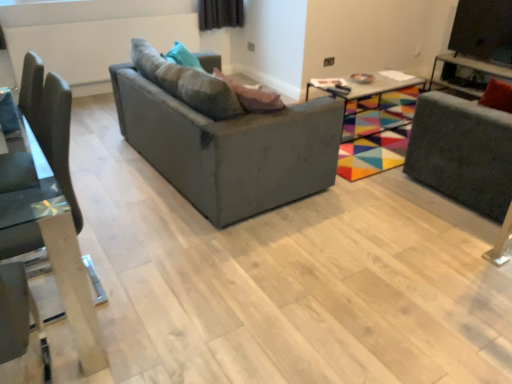
Question: Relative to velvet grey swivel chair at right, is transparent glass chair at left in front or behind?

Choices:
 (A) behind
 (B) front

Answer: (B)

Question: Is point (54, 273) positioned closer to the camera than point (464, 190)?

Choices:
 (A) farther
 (B) closer

Answer: (B)

Question: Which object is the closest to the metallic silver tv stand at upper right, the 2th table positioned from the left?

Choices:
 (A) velvet grey swivel chair at right
 (B) multicolored fabric table at center, marked as the 1th table in a left-to-right arrangement
 (C) transparent glass chair at left
 (D) black glossy tv at upper right
 (E) matte gray couch at center

Answer: (B)

Question: Which object is the farthest from the metallic silver tv stand at upper right, which is the first table in right-to-left order?

Choices:
 (A) transparent glass chair at left
 (B) black glossy tv at upper right
 (C) velvet grey swivel chair at right
 (D) matte gray couch at center
 (E) multicolored fabric table at center, marked as the 1th table in a left-to-right arrangement

Answer: (A)